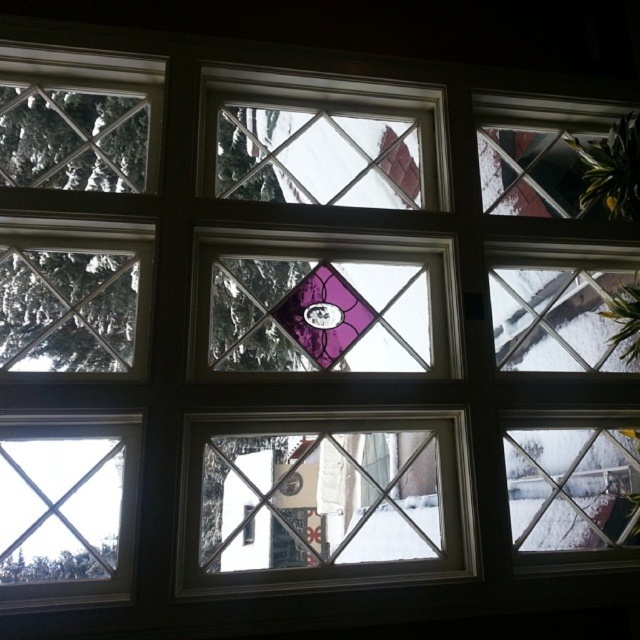
You are standing in front of the multi paned window and see two points marked on the window. The first point is at coordinate point (192, 464) and the second point is at coordinate point (131, 461). Which point is closer to you?

Point (192, 464) is further to the viewer than point (131, 461), so the point closer to you is point (131, 461).

You are an interior designer assessing the window layout. The clear glass window frame at center and the clear glass window at lower left are both part of the multi paned window. Which of these two has a greater width?

The clear glass window frame at center might be wider than clear glass window at lower left according to the description provided.